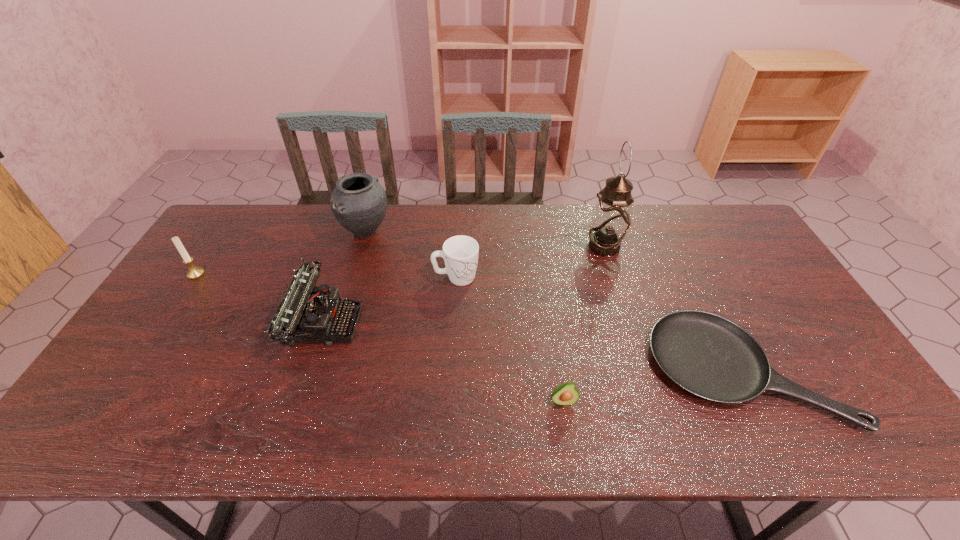
This screenshot has height=540, width=960. What are the coordinates of `vacant space located on the left of the second tallest object` in the screenshot? It's located at (316, 232).

At what (x,y) coordinates should I click in order to perform the action: click on vacant space situated 0.150m on the right of the third tallest object. Please return your answer as a coordinate pair (x, y). This screenshot has height=540, width=960. Looking at the image, I should click on (252, 274).

Where is `free space located 0.300m on the side of the mug with the handle`? free space located 0.300m on the side of the mug with the handle is located at coordinates (577, 278).

Locate an element on the screen. Image resolution: width=960 pixels, height=540 pixels. vacant space located 0.220m on the keyboard of the typewriter is located at coordinates (439, 322).

Identify the location of vacant space situated on the left of the shortest object. (538, 369).

Image resolution: width=960 pixels, height=540 pixels. I want to click on oil lamp that is at the far edge, so click(x=611, y=220).

This screenshot has width=960, height=540. Find the location of `urn present at the far edge`. urn present at the far edge is located at coordinates (359, 203).

Image resolution: width=960 pixels, height=540 pixels. Find the location of `object at the near edge`. object at the near edge is located at coordinates (707, 355).

Image resolution: width=960 pixels, height=540 pixels. I want to click on object positioned at the left edge, so click(x=194, y=272).

This screenshot has width=960, height=540. I want to click on object present at the right edge, so point(707,355).